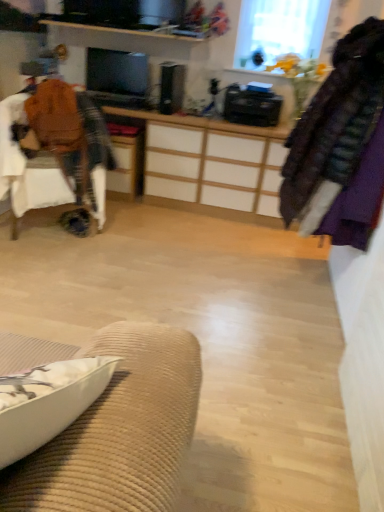
Find the location of a particular element. The image size is (384, 512). velvet purple coat at right is located at coordinates (x=341, y=146).

Describe the element at coordinates (279, 30) in the screenshot. The width and height of the screenshot is (384, 512). I see `transparent glass window at upper center` at that location.

Measure the distance between wooden desk at center and camera.

The depth of wooden desk at center is 2.88 meters.

In order to face matte black monitor at center, should I rotate leftwards or rightwards?

Turn left by 9.957 degrees to look at matte black monitor at center.

This screenshot has width=384, height=512. I want to click on velvet purple coat at right, so click(341, 146).

From the image's perspective, is wooden desk at center above or below transparent glass window at upper center?

wooden desk at center is below transparent glass window at upper center.

Measure the distance from wooden desk at center to transparent glass window at upper center.

The distance of wooden desk at center from transparent glass window at upper center is 3.92 feet.

Locate an element on the screen. window screen that is above the wooden desk at center (from a real-world perspective) is located at coordinates (279, 30).

Can you tell me how much wooden desk at center and transparent glass window at upper center differ in facing direction?

There is a 2.4-degree angle between the facing directions of wooden desk at center and transparent glass window at upper center.

From a real-world perspective, who is located higher, white fabric cushion at lower left or transparent glass window at upper center?

From a 3D spatial view, transparent glass window at upper center is above.

Considering the positions of point (114, 470) and point (296, 21), is point (114, 470) closer or farther from the camera than point (296, 21)?

Point (114, 470) appears to be closer to the viewer than point (296, 21).

Identify the location of furniture below the transparent glass window at upper center (from a real-world perspective). (119, 431).

Considering the relative sizes of white fabric cushion at lower left and transparent glass window at upper center in the image provided, is white fabric cushion at lower left shorter than transparent glass window at upper center?

Indeed, white fabric cushion at lower left has a lesser height compared to transparent glass window at upper center.

Which object is wider, matte black monitor at center or velvet purple coat at right?

Wider between the two is velvet purple coat at right.

From a real-world perspective, which is physically above, matte black monitor at center or velvet purple coat at right?

velvet purple coat at right.

Considering the sizes of objects matte black monitor at center and velvet purple coat at right in the image provided, who is smaller, matte black monitor at center or velvet purple coat at right?

With smaller size is matte black monitor at center.

From their relative heights in the image, would you say matte black monitor at center is taller or shorter than velvet purple coat at right?

Considering their sizes, matte black monitor at center has less height than velvet purple coat at right.

Can you confirm if velvet purple coat at right is taller than wooden desk at center?

Correct, velvet purple coat at right is much taller as wooden desk at center.

Is velvet purple coat at right wider than wooden desk at center?

Indeed, velvet purple coat at right has a greater width compared to wooden desk at center.

From the image's perspective, is velvet purple coat at right located above wooden desk at center?

Incorrect, from the image's perspective, velvet purple coat at right is lower than wooden desk at center.

You are a GUI agent. You are given a task and a screenshot of the screen. Output one action in this format:
    pyautogui.click(x=<x>, y=<y>)
    Task: Click on the clothing that appears below the wooden desk at center (from the image's perspective)
    The height and width of the screenshot is (512, 384).
    Given the screenshot: What is the action you would take?
    click(x=341, y=146)

Considering the sizes of brown fabric chair at left and matte black monitor at center in the image, is brown fabric chair at left taller or shorter than matte black monitor at center?

brown fabric chair at left is taller than matte black monitor at center.

From the image's perspective, relative to matte black monitor at center, is brown fabric chair at left above or below?

Clearly, from the image's perspective, brown fabric chair at left is below matte black monitor at center.

Is the surface of brown fabric chair at left in direct contact with matte black monitor at center?

No, brown fabric chair at left is not making contact with matte black monitor at center.

From the image's perspective, is white fabric cushion at lower left over matte black monitor at center?

No.

Does point (149, 386) come behind point (99, 84)?

No, it is not.

Is white fabric cushion at lower left facing away from matte black monitor at center?

A: No, matte black monitor at center is not at the back of white fabric cushion at lower left.

From a real-world perspective, between white fabric cushion at lower left and matte black monitor at center, who is vertically lower?

white fabric cushion at lower left is physically lower.

Between brown fabric chair at left and transparent glass window at upper center, which one appears on the right side from the viewer's perspective?

From the viewer's perspective, transparent glass window at upper center appears more on the right side.

Is brown fabric chair at left far away from transparent glass window at upper center?

Yes, brown fabric chair at left and transparent glass window at upper center are located far from each other.

Which of these two, brown fabric chair at left or transparent glass window at upper center, is bigger?

Bigger between the two is brown fabric chair at left.

Find the location of `window screen above the wooden desk at center (from a real-world perspective)`. window screen above the wooden desk at center (from a real-world perspective) is located at coordinates (279, 30).

Image resolution: width=384 pixels, height=512 pixels. I want to click on window screen above the white fabric cushion at lower left (from the image's perspective), so click(279, 30).

When comparing their distances from matte black monitor at center, does white fabric cushion at lower left or velvet purple coat at right seem closer?

The object closer to matte black monitor at center is velvet purple coat at right.

Which object lies nearer to the anchor point wooden desk at center, brown fabric chair at left or transparent glass window at upper center?

Among the two, brown fabric chair at left is located nearer to wooden desk at center.

From the image, which object appears to be farther from wooden desk at center, white fabric cushion at lower left or brown fabric chair at left?

Based on the image, white fabric cushion at lower left appears to be further to wooden desk at center.

Considering their positions, is white fabric cushion at lower left positioned further to brown fabric chair at left than transparent glass window at upper center?

white fabric cushion at lower left lies further to brown fabric chair at left than the other object.

Looking at the image, which one is located further to transparent glass window at upper center, velvet purple coat at right or brown fabric chair at left?

brown fabric chair at left lies further to transparent glass window at upper center than the other object.

Based on their spatial positions, is matte black monitor at center or velvet purple coat at right closer to wooden desk at center?

matte black monitor at center is closer to wooden desk at center.

Which object lies further to the anchor point white fabric cushion at lower left, matte black monitor at center or wooden desk at center?

matte black monitor at center is positioned further to the anchor white fabric cushion at lower left.

Based on their spatial positions, is matte black monitor at center or brown fabric chair at left further from transparent glass window at upper center?

brown fabric chair at left lies further to transparent glass window at upper center than the other object.

The width and height of the screenshot is (384, 512). I want to click on window screen positioned between white fabric cushion at lower left and wooden desk at center from near to far, so click(279, 30).

The height and width of the screenshot is (512, 384). In order to click on clothing between white fabric cushion at lower left and brown fabric chair at left in the front-back direction in this screenshot , I will do `click(341, 146)`.

Find the location of a particular element. The width and height of the screenshot is (384, 512). clothing located between white fabric cushion at lower left and wooden desk at center in the depth direction is located at coordinates (341, 146).

Find the location of a particular element. chair between white fabric cushion at lower left and matte black monitor at center in the front-back direction is located at coordinates (11, 151).